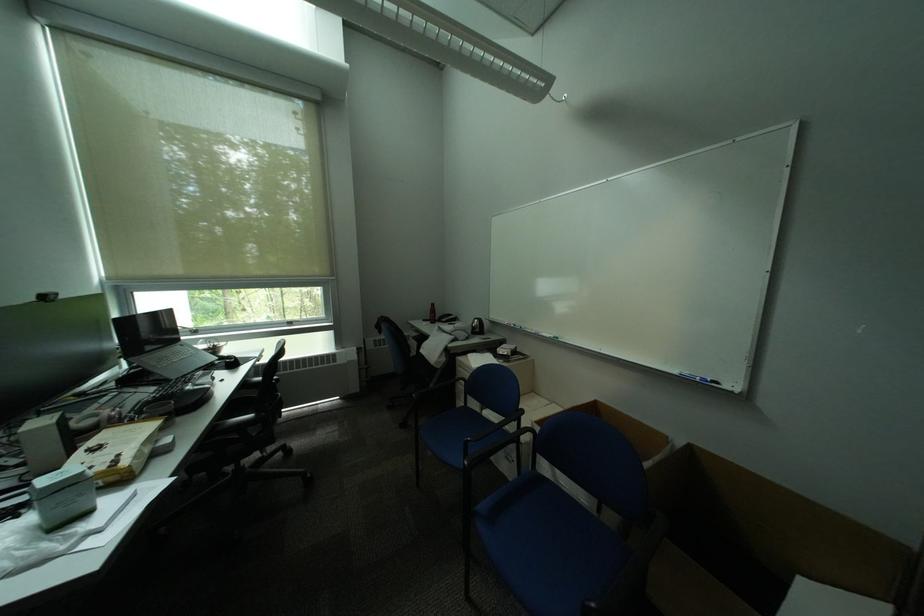
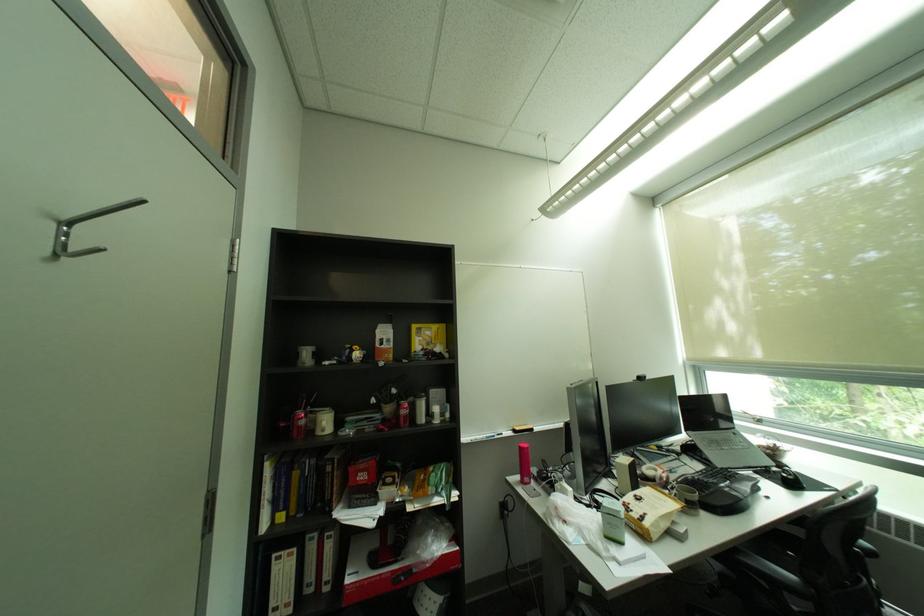
Where in the second image is the point corresponding to (x=167, y=392) from the first image?

(712, 472)